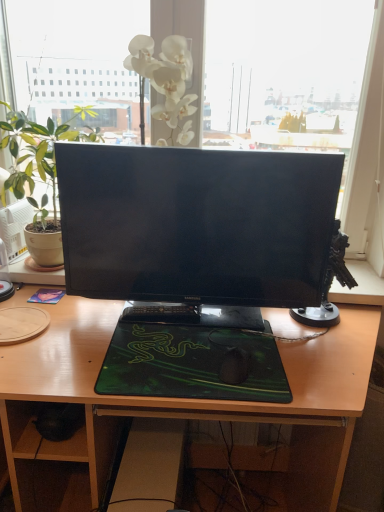
What do you see at coordinates (234, 366) in the screenshot?
I see `black matte mouse at center` at bounding box center [234, 366].

Measure the distance between point (75, 113) and camera.

Point (75, 113) is 1.45 meters away from camera.

What do you see at coordinates (198, 226) in the screenshot? This screenshot has height=512, width=384. I see `black glossy monitor at center` at bounding box center [198, 226].

Find the location of a particular element. The width and height of the screenshot is (384, 512). green matte mousepad at center is located at coordinates (193, 355).

Is black plastic keyboard at center closer to the viewer compared to black glossy monitor at center?

No.

Is black plastic keyboard at center next to black glossy monitor at center and touching it?

No, black plastic keyboard at center is not touching black glossy monitor at center.

Is black glossy monitor at center at the back of black plastic keyboard at center?

Yes, black plastic keyboard at center's orientation is away from black glossy monitor at center.

The height and width of the screenshot is (512, 384). I want to click on computer monitor in front of the black plastic keyboard at center, so click(198, 226).

Is black glossy monitor at center wider or thinner than black matte mouse at center?

Clearly, black glossy monitor at center has less width compared to black matte mouse at center.

What are the coordinates of `computer monitor above the black matte mouse at center (from a real-world perspective)` in the screenshot? It's located at (198, 226).

Between black glossy monitor at center and black matte mouse at center, which one is positioned in front?

black matte mouse at center.

Between green matte mousepad at center and black plastic keyboard at center, which one has larger size?

green matte mousepad at center.

From a real-world perspective, which object stands above the other?

In real-world perspective, black plastic keyboard at center is above.

Which point is more forward, (171, 336) or (196, 319)?

The point (171, 336) is more forward.

How different are the orientations of green matte mousepad at center and black plastic keyboard at center in degrees?

They differ by 4.22 degrees in their facing directions.

From a real-world perspective, is wooden desk at center physically located above or below black matte mouse at center?

Clearly, from a real-world perspective, wooden desk at center is below black matte mouse at center.

Is wooden desk at center facing towards black matte mouse at center?

No.

Is wooden desk at center next to black matte mouse at center?

wooden desk at center is not next to black matte mouse at center, and they're not touching.

Between black plastic keyboard at center and black matte mouse at center, which one has less height?

black matte mouse at center.

Between black plastic keyboard at center and black matte mouse at center, which one is positioned in front?

Positioned in front is black matte mouse at center.

Which is further, (x=145, y=316) or (x=242, y=361)?

The point (x=145, y=316) is farther from the camera.

From a real-world perspective, which object rests below the other?

In real-world perspective, green matte mousepad at center is lower.

From the image's perspective, is green matte mousepad at center located above or below black glossy monitor at center?

green matte mousepad at center is situated lower than black glossy monitor at center in the image.

Is green matte mousepad at center facing towards black glossy monitor at center?

No, green matte mousepad at center is not oriented towards black glossy monitor at center.

From a real-world perspective, which is physically above, black matte mouse at center or black plastic keyboard at center?

black plastic keyboard at center is physically above.

Considering the sizes of black matte mouse at center and black plastic keyboard at center in the image, is black matte mouse at center bigger or smaller than black plastic keyboard at center?

Considering their sizes, black matte mouse at center takes up less space than black plastic keyboard at center.

You are a GUI agent. You are given a task and a screenshot of the screen. Output one action in this format:
    pyautogui.click(x=<x>, y=<y>)
    Task: Click on the laptop keyboard above the black matte mouse at center (from the image's perspective)
    
    Given the screenshot: What is the action you would take?
    pyautogui.click(x=161, y=312)

Is black matte mouse at center thinner than black plastic keyboard at center?

In fact, black matte mouse at center might be wider than black plastic keyboard at center.

Find the location of a particular element. Image resolution: width=384 pixels, height=512 pixels. computer monitor above the black plastic keyboard at center (from the image's perspective) is located at coordinates (198, 226).

Identify the location of mouse located on the right of black glossy monitor at center. The height and width of the screenshot is (512, 384). (234, 366).

Consider the image. Which object lies further to the anchor point black matte mouse at center, black glossy monitor at center or black plastic keyboard at center?

black glossy monitor at center is further to black matte mouse at center.

Looking at this image, based on their spatial positions, is black plastic keyboard at center or wooden desk at center closer to green matte mousepad at center?

black plastic keyboard at center.

From the image, which object appears to be nearer to green matte houseplant at left, green matte mousepad at center or black matte mouse at center?

green matte mousepad at center.

Based on the photo, estimate the real-world distances between objects in this image. Which object is further from wooden desk at center, black plastic keyboard at center or black glossy monitor at center?

black plastic keyboard at center is positioned further to the anchor wooden desk at center.

Estimate the real-world distances between objects in this image. Which object is further from green matte mousepad at center, black plastic keyboard at center or black glossy monitor at center?

black glossy monitor at center is further to green matte mousepad at center.

From the image, which object appears to be farther from black plastic keyboard at center, wooden desk at center or green matte houseplant at left?

green matte houseplant at left is further to black plastic keyboard at center.

When comparing their distances from wooden desk at center, does green matte mousepad at center or black matte mouse at center seem further?

black matte mouse at center.

Looking at the image, which one is located closer to green matte houseplant at left, green matte mousepad at center or black plastic keyboard at center?

black plastic keyboard at center.

This screenshot has height=512, width=384. I want to click on desktop located between green matte houseplant at left and black matte mouse at center in the left-right direction, so click(x=193, y=355).

I want to click on desktop that lies between black glossy monitor at center and black matte mouse at center from top to bottom, so click(193, 355).

Identify the location of mouse between green matte mousepad at center and wooden desk at center vertically. This screenshot has height=512, width=384. (234, 366).

This screenshot has width=384, height=512. Find the location of `mouse between green matte houseplant at left and wooden desk at center vertically`. mouse between green matte houseplant at left and wooden desk at center vertically is located at coordinates (234, 366).